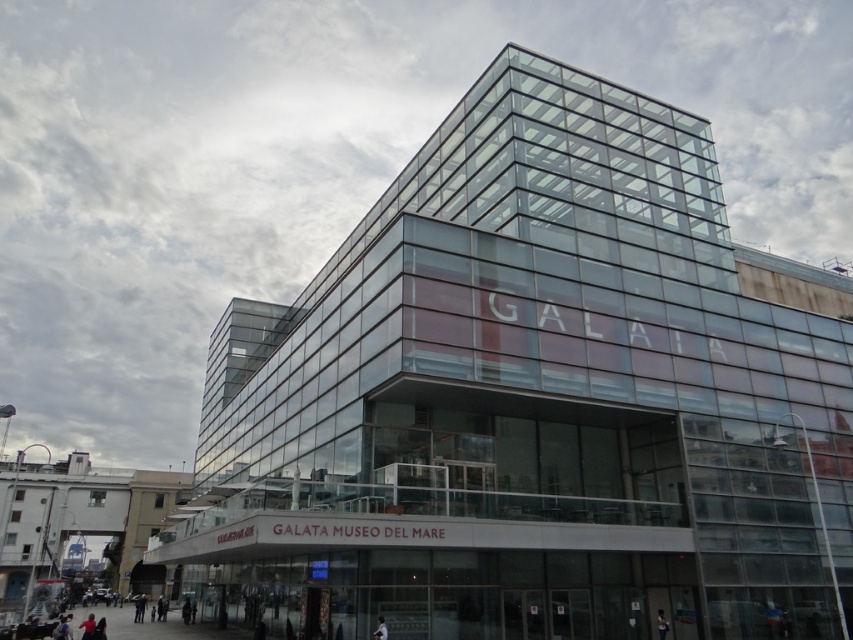
Question: Is dark blue jeans at lower center below dark gray jacket at lower center?

Choices:
 (A) no
 (B) yes

Answer: (B)

Question: Which point is closer to the camera?

Choices:
 (A) dark gray jacket at lower center
 (B) dark blue jeans at lower center
 (C) dark gray fabric jacket at lower center

Answer: (C)

Question: Does dark blue jeans at lower center have a larger size compared to dark gray jacket at lower center?

Choices:
 (A) no
 (B) yes

Answer: (B)

Question: Which of the following is the farthest from the observer?

Choices:
 (A) light brown leather jacket at lower right
 (B) dark blue jeans at lower left
 (C) dark blue jeans at lower center
 (D) dark gray jacket at lower center

Answer: (D)

Question: Which point is farther to the camera?

Choices:
 (A) [138, 618]
 (B) [163, 611]
 (C) [91, 624]

Answer: (A)

Question: Can you confirm if dark blue jeans at lower left is positioned to the right of light brown leather jacket at lower right?

Choices:
 (A) yes
 (B) no

Answer: (B)